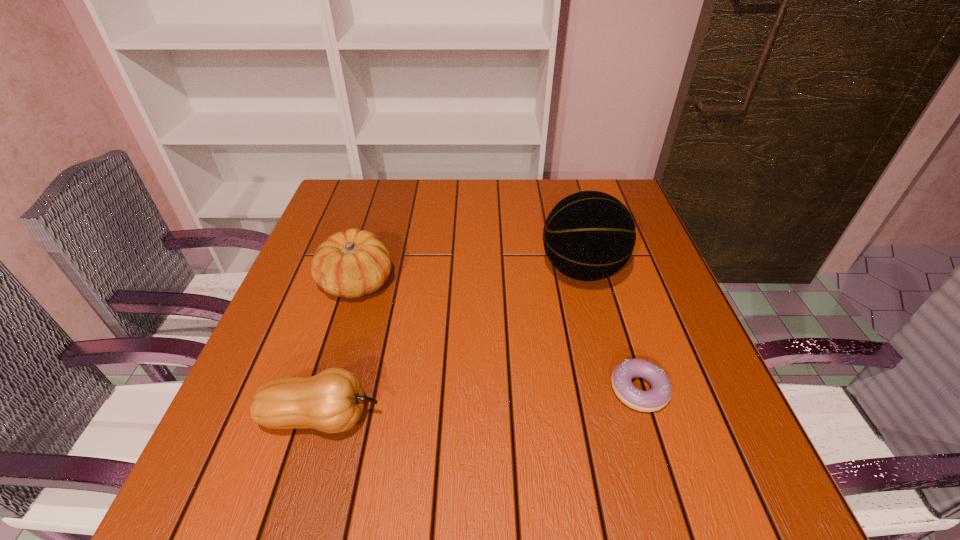
What are the coordinates of `free space that is in between the farther gourd and the nearer gourd` in the screenshot? It's located at (340, 349).

The height and width of the screenshot is (540, 960). I want to click on unoccupied area between the nearer gourd and the shortest object, so click(480, 403).

Locate an element on the screen. The image size is (960, 540). vacant area that lies between the basketball and the nearer gourd is located at coordinates (452, 344).

Locate an element on the screen. The image size is (960, 540). vacant region between the basketball and the shortest object is located at coordinates (611, 330).

Find the location of a particular element. The image size is (960, 540). object that ranks as the third closest to the nearer gourd is located at coordinates (656, 398).

Select which object appears as the closest to the doughnut. Please provide its 2D coordinates. Your answer should be formatted as a tuple, i.e. [(x, y)], where the tuple contains the x and y coordinates of a point satisfying the conditions above.

[(589, 235)]

Locate an element on the screen. This screenshot has height=540, width=960. free space that satisfies the following two spatial constraints: 1. on the front side of the basketball; 2. on the stem side of the nearer gourd is located at coordinates (620, 417).

Find the location of `free point that satisfies the following two spatial constraints: 1. on the front side of the farther gourd; 2. on the right side of the shortest object`. free point that satisfies the following two spatial constraints: 1. on the front side of the farther gourd; 2. on the right side of the shortest object is located at coordinates (324, 390).